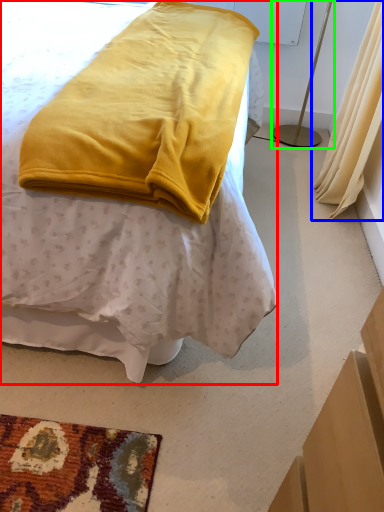
Question: Which object is positioned farthest from bed (highlighted by a red box)? Select from curtain (highlighted by a blue box) and bedside lamp (highlighted by a green box).

Choices:
 (A) curtain
 (B) bedside lamp

Answer: (B)